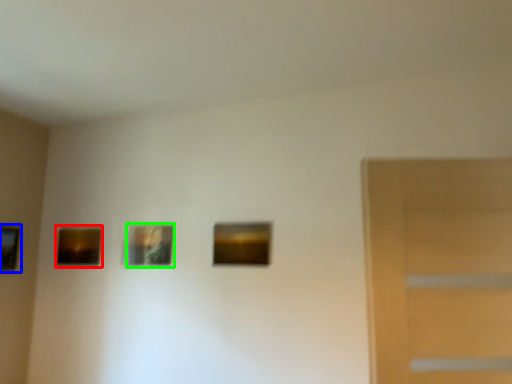
Question: Considering the real-world distances, which object is farthest from picture frame (highlighted by a red box)? picture frame (highlighted by a blue box) or picture frame (highlighted by a green box)?

Choices:
 (A) picture frame
 (B) picture frame

Answer: (B)